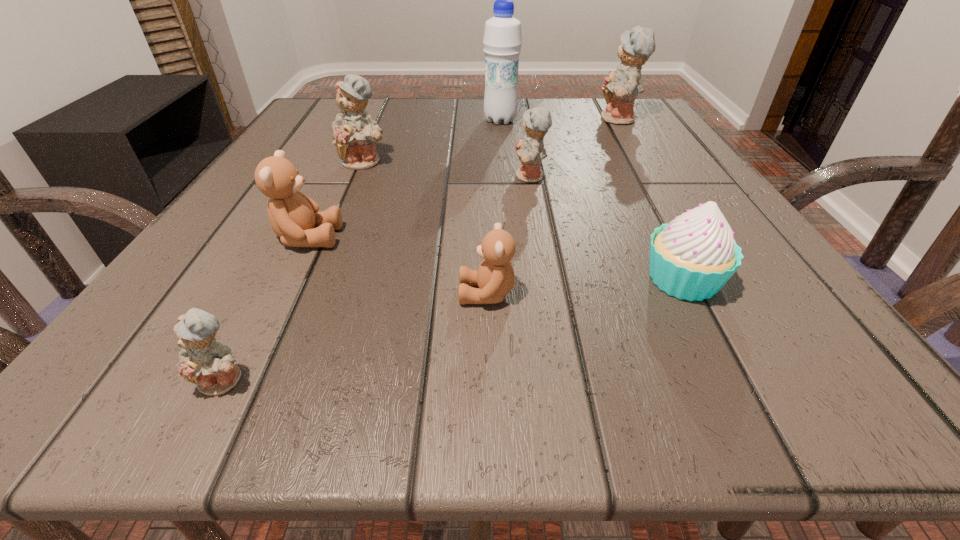
Image resolution: width=960 pixels, height=540 pixels. I want to click on free space at the near right corner, so click(744, 366).

Locate an element on the screen. This screenshot has width=960, height=540. vacant space that is in between the fourth farthest teddy bear and the second smallest blue teddy bear is located at coordinates (419, 207).

Identify the location of empty location between the blue water bottle and the second smallest blue teddy bear. (516, 148).

At what (x,y) coordinates should I click in order to perform the action: click on free area in between the water bottle and the cupcake. Please return your answer as a coordinate pair (x, y). Looking at the image, I should click on (591, 200).

At what (x,y) coordinates should I click in order to perform the action: click on free space between the water bottle and the fifth teddy bear from left to right. Please return your answer as a coordinate pair (x, y). The image size is (960, 540). Looking at the image, I should click on (516, 148).

Find the location of a particular element. This screenshot has width=960, height=540. vacant space that's between the second tallest object and the fourth teddy bear from left to right is located at coordinates (553, 207).

Locate an element on the screen. Image resolution: width=960 pixels, height=540 pixels. free space between the second biggest blue teddy bear and the fourth teddy bear from left to right is located at coordinates (425, 228).

This screenshot has height=540, width=960. What are the coordinates of `free space between the second biggest blue teddy bear and the rightmost teddy bear` in the screenshot? It's located at (492, 141).

The height and width of the screenshot is (540, 960). What are the coordinates of `free space between the third tallest object and the water bottle` in the screenshot? It's located at 432,141.

I want to click on free space between the fourth teddy bear from left to right and the second biggest blue teddy bear, so click(425, 228).